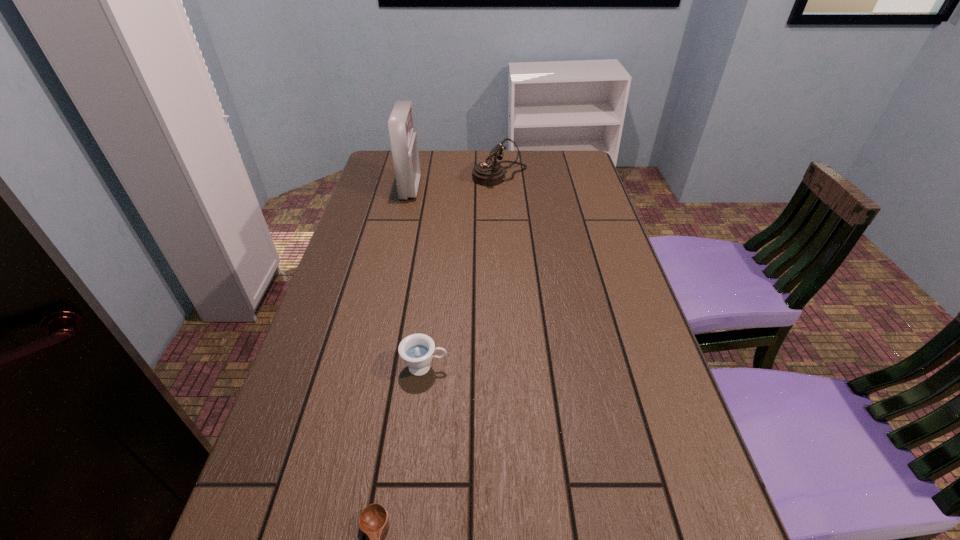
Locate an element on the screen. The image size is (960, 540). the leftmost object is located at coordinates (404, 144).

This screenshot has width=960, height=540. I want to click on the first-aid kit, so click(x=404, y=144).

The image size is (960, 540). In order to click on the rightmost object in this screenshot , I will do [489, 173].

Identify the location of telephone. The width and height of the screenshot is (960, 540). [489, 173].

Image resolution: width=960 pixels, height=540 pixels. In order to click on teacup in this screenshot , I will do `click(416, 350)`.

Where is `the third tallest object`? The width and height of the screenshot is (960, 540). the third tallest object is located at coordinates click(416, 350).

Locate an element on the screen. This screenshot has width=960, height=540. free space located 0.380m on the front-facing side of the leftmost object is located at coordinates (529, 188).

This screenshot has height=540, width=960. I want to click on vacant region located 0.210m on the left of the third shortest object, so click(414, 175).

What are the coordinates of `vacant space located 0.260m on the side of the third farthest object with the handle` in the screenshot? It's located at (567, 367).

What are the coordinates of `the first-aid kit positioned at the far edge` in the screenshot? It's located at (404, 144).